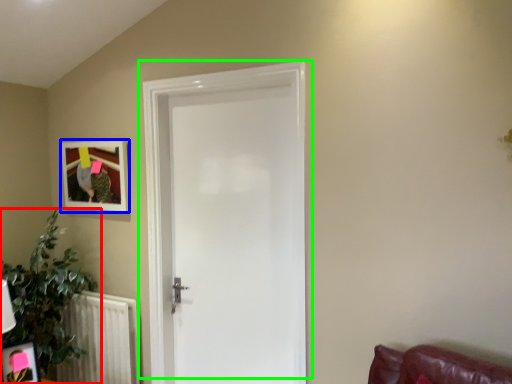
Question: Based on their relative distances, which object is farther from houseplant (highlighted by a red box)? Choose from picture frame (highlighted by a blue box) and door (highlighted by a green box).

Choices:
 (A) picture frame
 (B) door

Answer: (B)